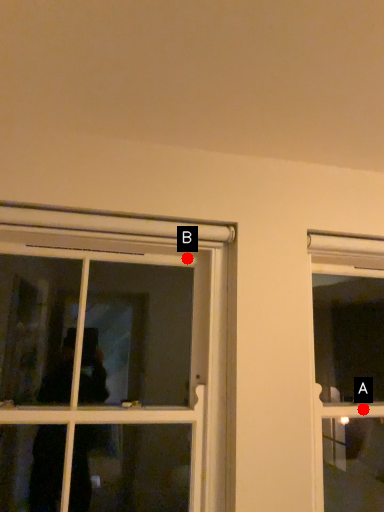
Question: Two points are circled on the image, labeled by A and B beside each circle. Among these points, which one is nearest to the camera?

Choices:
 (A) A is closer
 (B) B is closer

Answer: (B)